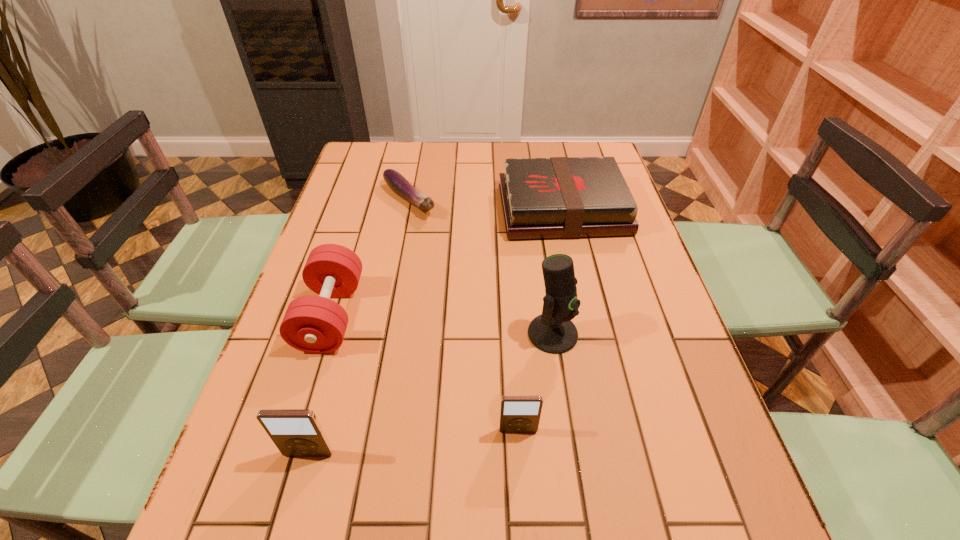
The height and width of the screenshot is (540, 960). Find the location of `vacant space at the left edge of the desktop`. vacant space at the left edge of the desktop is located at coordinates (299, 394).

The height and width of the screenshot is (540, 960). What are the coordinates of `vacant space at the right edge` in the screenshot? It's located at (648, 290).

Identify the location of free space at the far left corner. The height and width of the screenshot is (540, 960). (352, 158).

Find the location of a particular element. The height and width of the screenshot is (540, 960). vacant space at the far right corner of the desktop is located at coordinates 569,155.

This screenshot has width=960, height=540. In the image, there is a desktop. Find the location of `vacant space at the near right corner`. vacant space at the near right corner is located at coordinates (690, 451).

Find the location of a particular element. The height and width of the screenshot is (540, 960). empty space that is in between the dumbbell and the hardback book is located at coordinates (446, 262).

You are a GUI agent. You are given a task and a screenshot of the screen. Output one action in this format:
    pyautogui.click(x=<x>, y=<y>)
    Task: Click on the vacant space that is in between the hardback book and the taller iPod
    The image size is (960, 540).
    Given the screenshot: What is the action you would take?
    tap(436, 332)

The image size is (960, 540). What are the coordinates of `unoccupied position between the shorter iPod and the taller iPod` in the screenshot? It's located at (414, 442).

Locate an element on the screen. free space between the dumbbell and the second shortest object is located at coordinates (446, 262).

Where is `vacant area that lies between the microphone and the dumbbell`? The height and width of the screenshot is (540, 960). vacant area that lies between the microphone and the dumbbell is located at coordinates tap(442, 325).